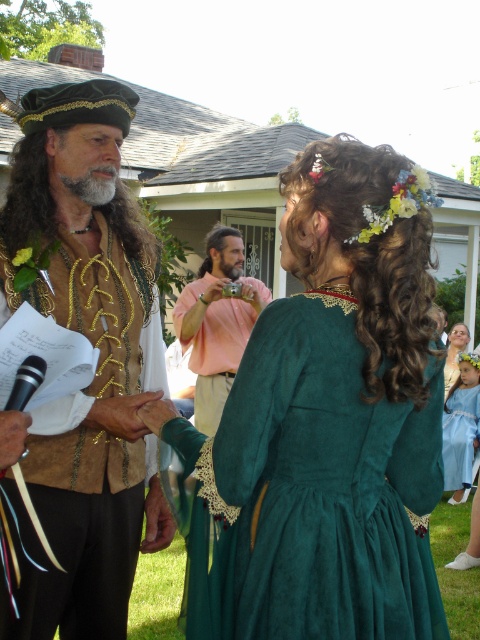
Question: Which point is farther to the camera?

Choices:
 (A) [x=475, y=420]
 (B) [x=210, y=412]

Answer: (A)

Question: Among these objects, which one is nearest to the camera?

Choices:
 (A) light blue satin dress at lower right
 (B) emerald velvet dress at center
 (C) matte gold vest at left
 (D) curly brown hair at center

Answer: (D)

Question: Among these objects, which one is farthest from the camera?

Choices:
 (A) emerald velvet dress at center
 (B) matte gold vest at left
 (C) curly brown hair at center

Answer: (A)

Question: Is brown curly hair at center smaller than grayhairbeard at center?

Choices:
 (A) yes
 (B) no

Answer: (B)

Question: Is green velvet dress at center above emerald velvet dress at center?

Choices:
 (A) yes
 (B) no

Answer: (B)

Question: Considering the relative positions of green velvet dress at center and floral fabric headband at upper right in the image provided, where is green velvet dress at center located with respect to floral fabric headband at upper right?

Choices:
 (A) left
 (B) right

Answer: (A)